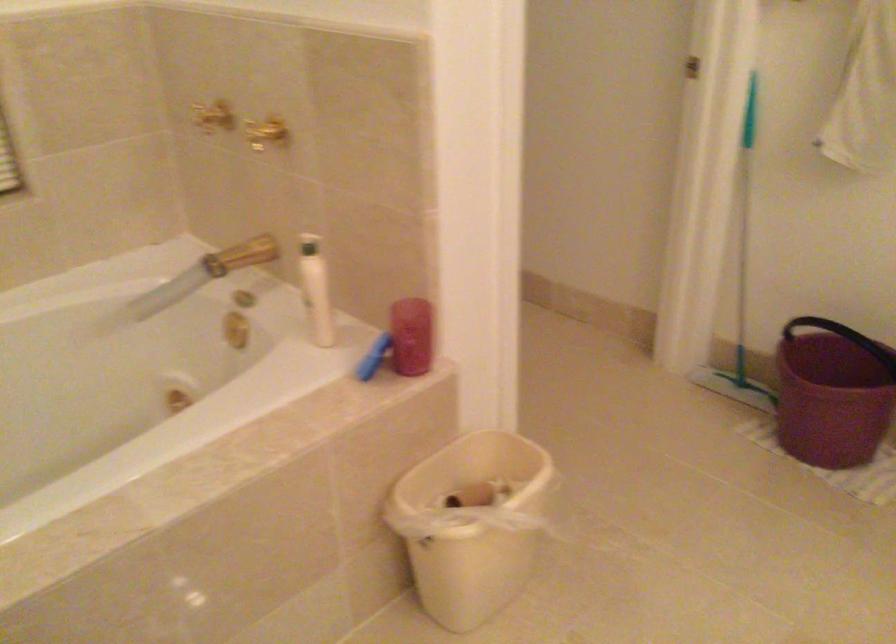
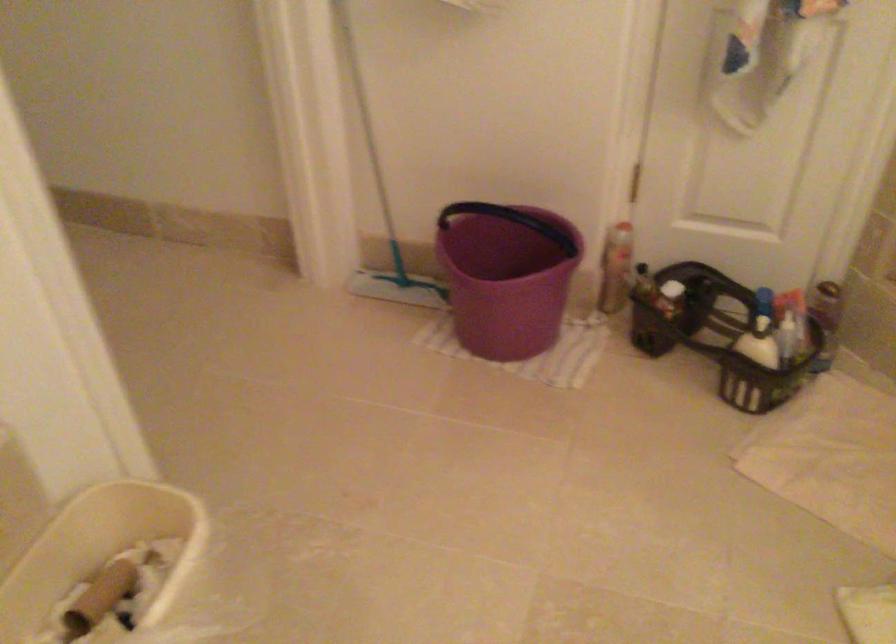
Question: The camera is either moving clockwise (left) or counter-clockwise (right) around the object. The first image is from the beginning of the video and the second image is from the end. Is the camera moving left or right when shooting the video?

Choices:
 (A) Left
 (B) Right

Answer: (A)